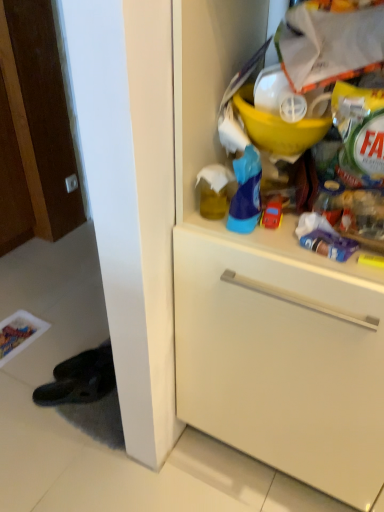
Question: Is white matte cabinet at upper right situated inside red plastic toy car at center or outside?

Choices:
 (A) outside
 (B) inside

Answer: (A)

Question: Is white matte cabinet at upper right wider or thinner than red plastic toy car at center?

Choices:
 (A) thin
 (B) wide

Answer: (B)

Question: From the image's perspective, is white matte cabinet at upper right above or below red plastic toy car at center?

Choices:
 (A) below
 (B) above

Answer: (A)

Question: From their relative heights in the image, would you say red plastic toy car at center is taller or shorter than white matte cabinet at upper right?

Choices:
 (A) short
 (B) tall

Answer: (A)

Question: Considering the positions of point (274, 225) and point (249, 440), is point (274, 225) closer or farther from the camera than point (249, 440)?

Choices:
 (A) closer
 (B) farther

Answer: (A)

Question: Considering the positions of red plastic toy car at center and white matte cabinet at upper right in the image, is red plastic toy car at center bigger or smaller than white matte cabinet at upper right?

Choices:
 (A) small
 (B) big

Answer: (A)

Question: Considering the positions of red plastic toy car at center and white matte cabinet at upper right in the image, is red plastic toy car at center wider or thinner than white matte cabinet at upper right?

Choices:
 (A) thin
 (B) wide

Answer: (A)